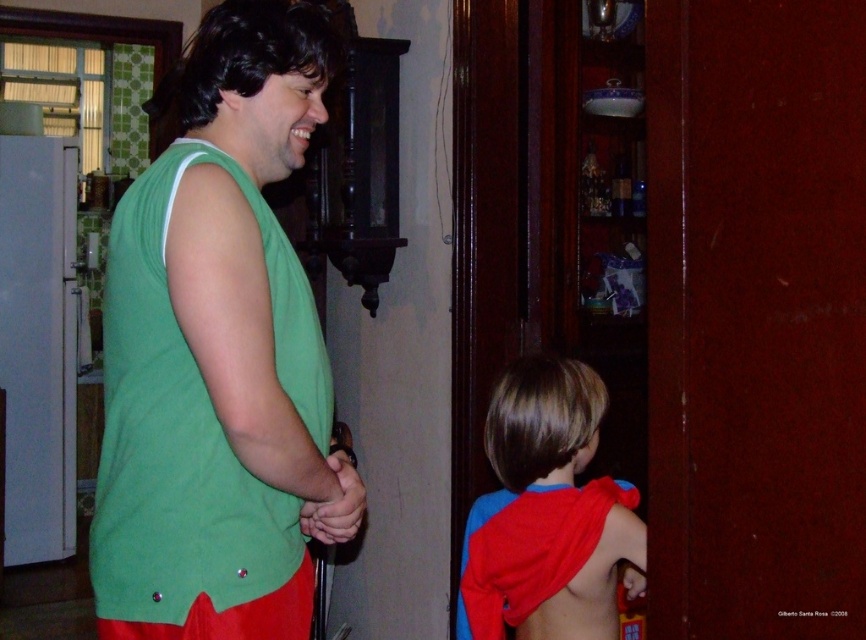
You are designing a costume for a play and need to decide which fabric pieces to use. Given the green fabric shirt at center and the red fabric cape at lower right, which one requires more fabric material?

The green fabric shirt at center requires more fabric material because it is bigger than the red fabric cape at lower right.

You are a tailor measuring fabrics for a costume. You have a green fabric shirt at center and a red fabric cape at lower right. Which fabric has a greater width?

The green fabric shirt at center has a greater width than the red fabric cape at lower right according to the description.

What are the coordinates of the green fabric shirt at center?

The green fabric shirt at center is located at point [218,353].